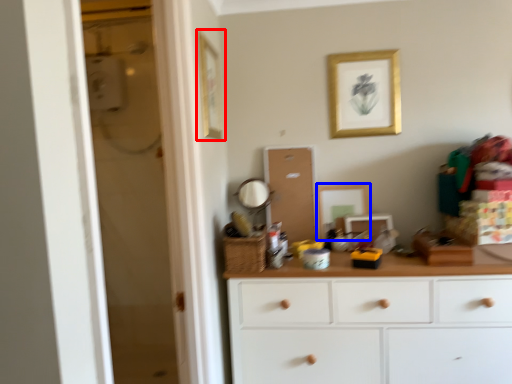
Question: Which object appears closest to the camera in this image, picture frame (highlighted by a red box) or picture frame (highlighted by a blue box)?

Choices:
 (A) picture frame
 (B) picture frame

Answer: (A)